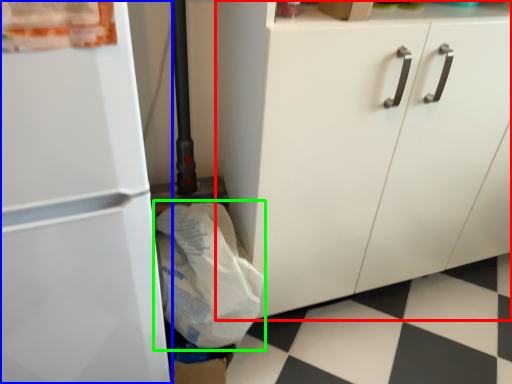
Question: Which object is positioned farthest from cabinetry (highlighted by a red box)? Select from refrigerator (highlighted by a blue box) and grocery bag (highlighted by a green box).

Choices:
 (A) refrigerator
 (B) grocery bag

Answer: (A)